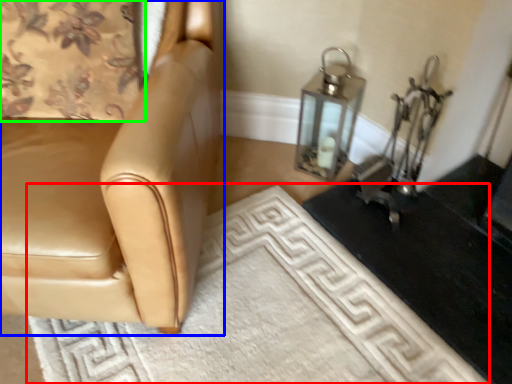
Question: Which object is positioned farthest from doormat (highlighted by a red box)? Select from chair (highlighted by a blue box) and curtain (highlighted by a green box).

Choices:
 (A) chair
 (B) curtain

Answer: (B)